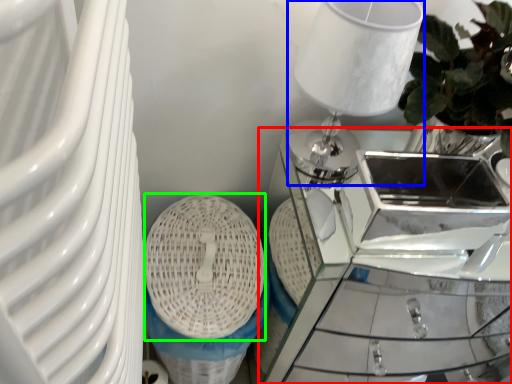
Question: Considering the real-world distances, which object is closest to table (highlighted by a red box)? table lamp (highlighted by a blue box) or basket (highlighted by a green box).

Choices:
 (A) table lamp
 (B) basket

Answer: (B)